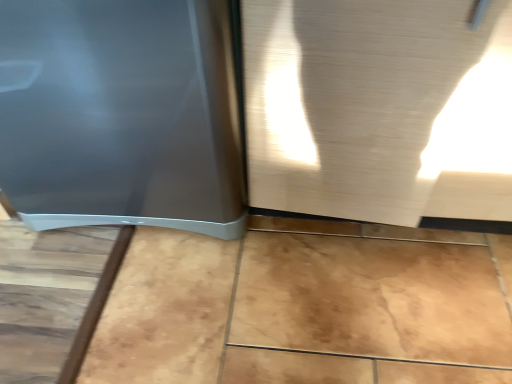
The width and height of the screenshot is (512, 384). Describe the element at coordinates (379, 108) in the screenshot. I see `satin wood screen door at lower right` at that location.

Find the location of a particular element. This screenshot has width=512, height=384. satin wood screen door at lower right is located at coordinates (379, 108).

I want to click on satin wood screen door at lower right, so click(x=379, y=108).